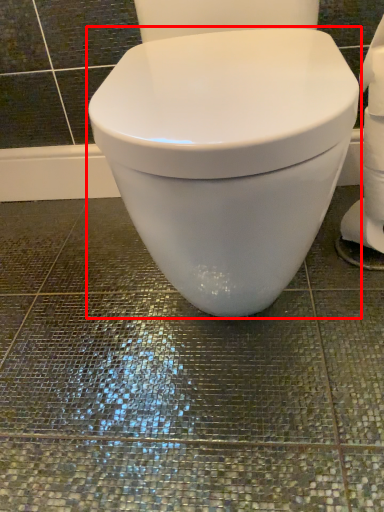
Question: Observing the image, what is the correct spatial positioning of toilet (annotated by the red box) in reference to toilet paper?

Choices:
 (A) right
 (B) left

Answer: (B)